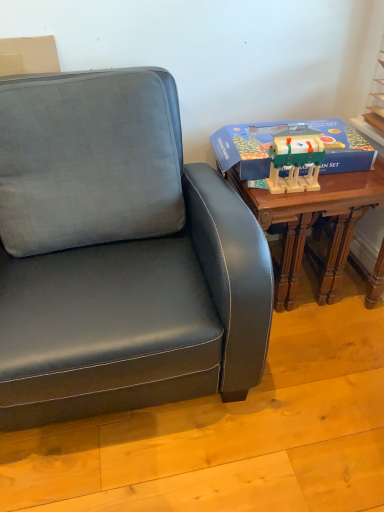
The image size is (384, 512). In order to click on space that is in front of wooden table at right in this screenshot , I will do click(311, 371).